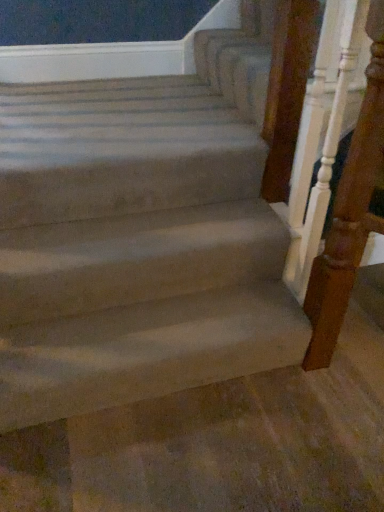
Describe the element at coordinates (349, 211) in the screenshot. I see `white wood railing at right` at that location.

Where is `white wood railing at right`? white wood railing at right is located at coordinates (349, 211).

What is the approximate height of white wood railing at right?

The height of white wood railing at right is 3.40 feet.

Find the location of a particular element. The width and height of the screenshot is (384, 512). white wood railing at right is located at coordinates (349, 211).